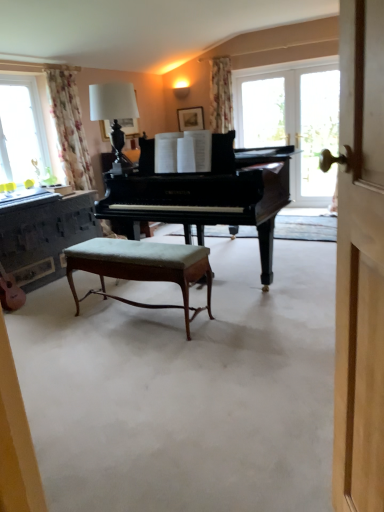
I want to click on vacant area in front of green fabric stool at center, so click(132, 362).